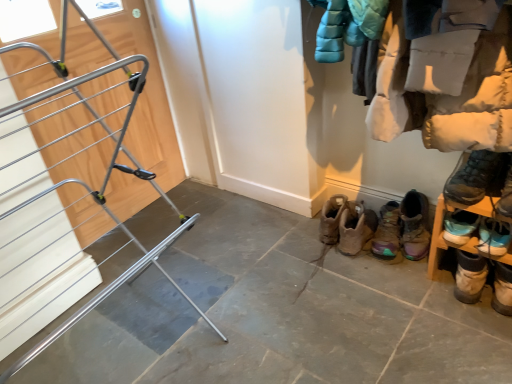
This screenshot has height=384, width=512. Find the location of `free spot below white fluffy coat at upper right (from a real-world perspective)`. free spot below white fluffy coat at upper right (from a real-world perspective) is located at coordinates (414, 306).